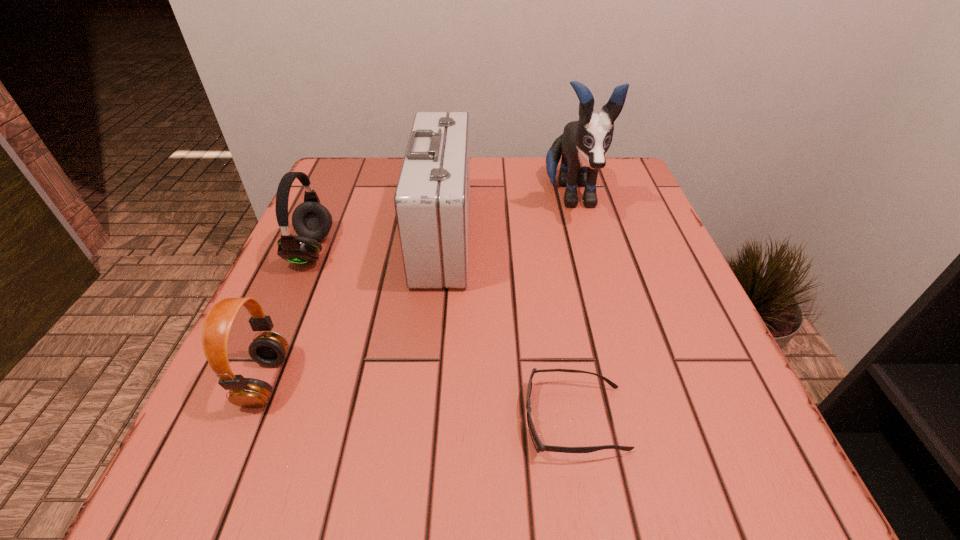
Locate an element on the screen. vacant space located 0.060m on the front-facing side of the shortest object is located at coordinates (483, 419).

Find the location of a particular element. Image resolution: width=960 pixels, height=540 pixels. free region located on the front-facing side of the shortest object is located at coordinates (377, 419).

Identify the location of free region located on the front-facing side of the shortest object. The height and width of the screenshot is (540, 960). (398, 419).

The height and width of the screenshot is (540, 960). Find the location of `puppy present at the far edge`. puppy present at the far edge is located at coordinates (583, 145).

In order to click on the first-aid kit located in the far edge section of the desktop in this screenshot , I will do `click(432, 199)`.

This screenshot has height=540, width=960. Identify the location of object located at the near edge. (539, 447).

You are a GUI agent. You are given a task and a screenshot of the screen. Output one action in this format:
    pyautogui.click(x=<x>, y=<y>)
    Task: Click on the object that is at the right edge
    This screenshot has height=540, width=960.
    Given the screenshot: What is the action you would take?
    pyautogui.click(x=583, y=145)

At what (x,y) coordinates should I click in order to perform the action: click on object present at the far right corner. Please return your answer as a coordinate pair (x, y). This screenshot has width=960, height=540. Looking at the image, I should click on (583, 145).

Locate an element on the screen. Image resolution: width=960 pixels, height=540 pixels. vacant space at the far edge of the desktop is located at coordinates (389, 191).

Image resolution: width=960 pixels, height=540 pixels. I want to click on vacant space at the near edge of the desktop, so click(603, 446).